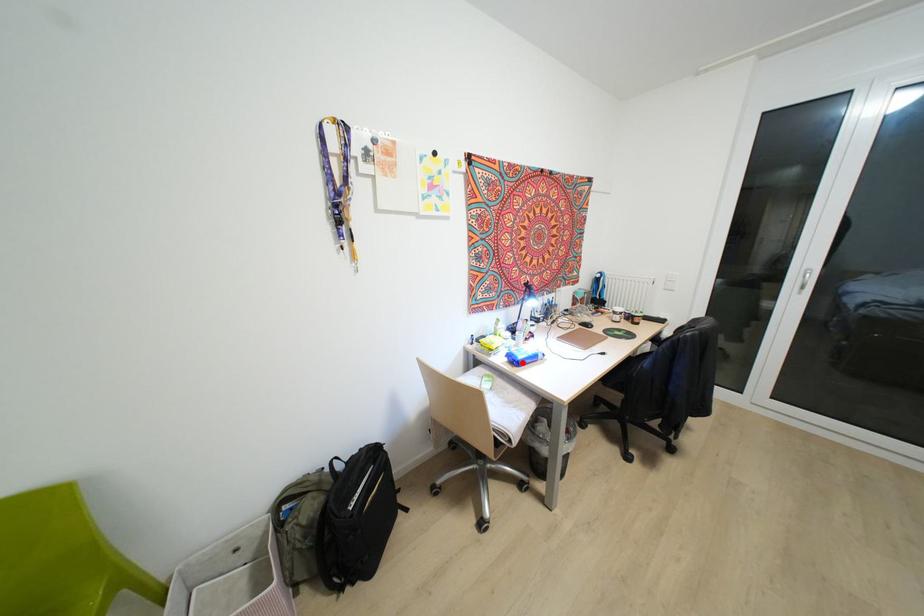
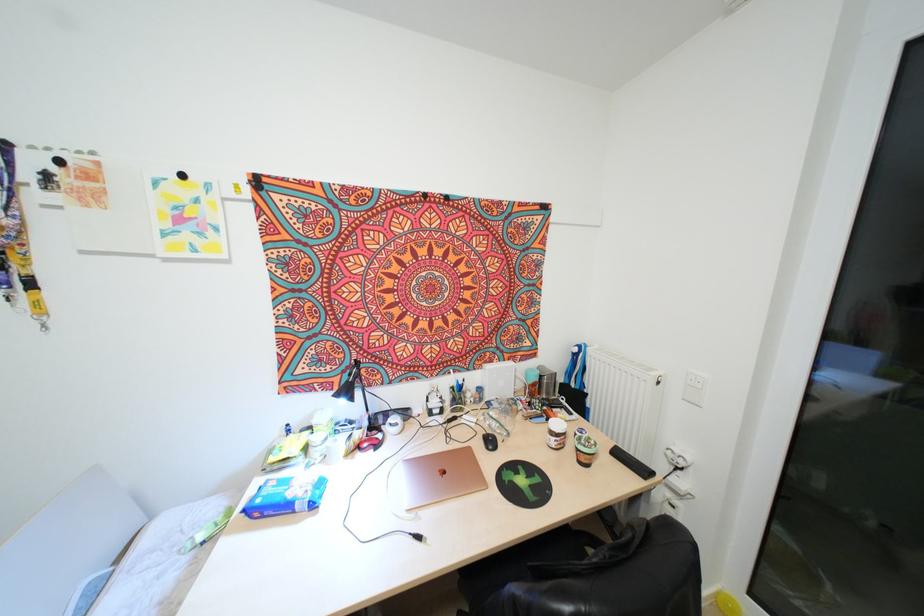
Find the pixel in the second image that matches the highlighted location in the first image.

(256, 514)